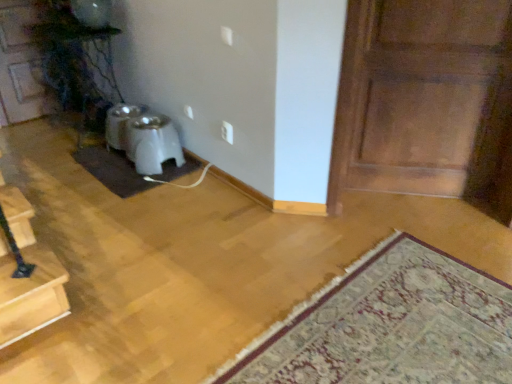
Find the location of a particular element. This screenshot has width=512, height=384. vacant area that lies in front of wooden panel door at right, the 2th door in the left-to-right sequence is located at coordinates (441, 243).